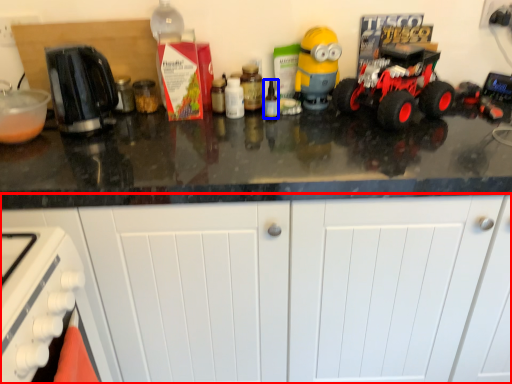
Question: Which object is further to the camera taking this photo, cabinetry (highlighted by a red box) or bottle (highlighted by a blue box)?

Choices:
 (A) cabinetry
 (B) bottle

Answer: (B)